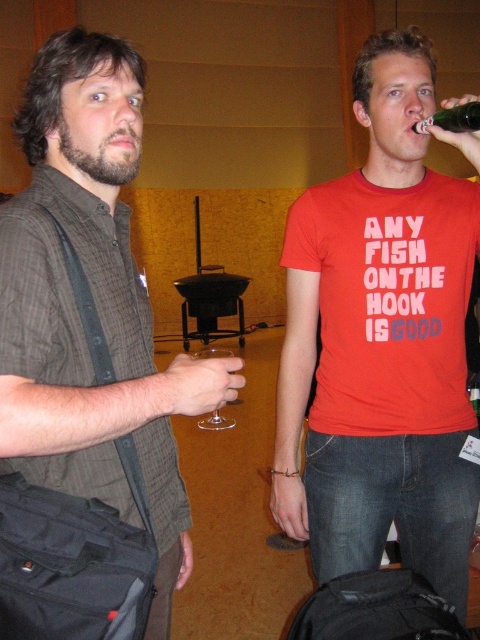
Between matte black shirt at left and clear glass wine at upper right, which one is positioned higher?

clear glass wine at upper right

Is point (145, 586) behind point (423, 120)?

No, (145, 586) is closer to viewer.

What are the coordinates of `matte black shirt at left` in the screenshot? It's located at (86, 369).

Which of these two, matte red t-shirt at center or transparent glass at center, stands shorter?

transparent glass at center

Does matte red t-shirt at center have a lesser width compared to transparent glass at center?

In fact, matte red t-shirt at center might be wider than transparent glass at center.

This screenshot has width=480, height=640. Find the location of `matte red t-shirt at center`. matte red t-shirt at center is located at coordinates (381, 342).

Is matte black shirt at left taller than transparent glass at center?

Correct, matte black shirt at left is much taller as transparent glass at center.

Where is `matte black shirt at left`? The width and height of the screenshot is (480, 640). matte black shirt at left is located at coordinates (86, 369).